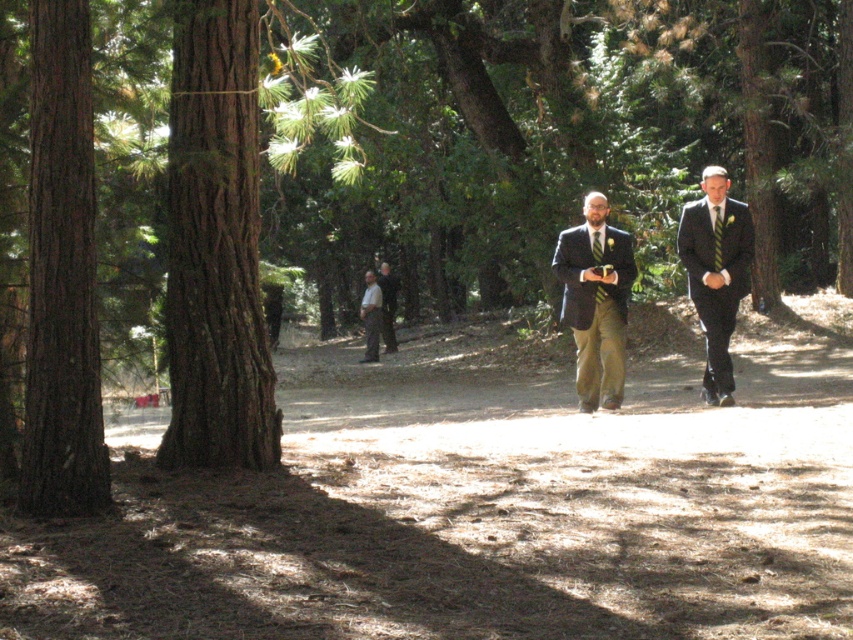
Can you confirm if dirt path at center is bigger than light brown leather jacket at center?

Indeed, dirt path at center has a larger size compared to light brown leather jacket at center.

Does dirt path at center come behind light brown leather jacket at center?

No, it is in front of light brown leather jacket at center.

The image size is (853, 640). In order to click on dirt path at center in this screenshot , I will do `click(474, 509)`.

Is matte black suit at center positioned before dark gray suit at center?

That is True.

Which is behind, point (611, 305) or point (386, 328)?

Point (386, 328)

The width and height of the screenshot is (853, 640). I want to click on matte black suit at center, so click(595, 301).

The image size is (853, 640). Find the location of `matte black suit at center`. matte black suit at center is located at coordinates (595, 301).

Based on the photo, is dirt path at center wider than smooth brown bark at left?

Answer: Yes, dirt path at center is wider than smooth brown bark at left.

Measure the distance between dirt path at center and camera.

dirt path at center is 18.27 feet from camera.

Does point (369, 540) come in front of point (88, 288)?

Yes, it is.

The image size is (853, 640). Find the location of `dirt path at center`. dirt path at center is located at coordinates (474, 509).